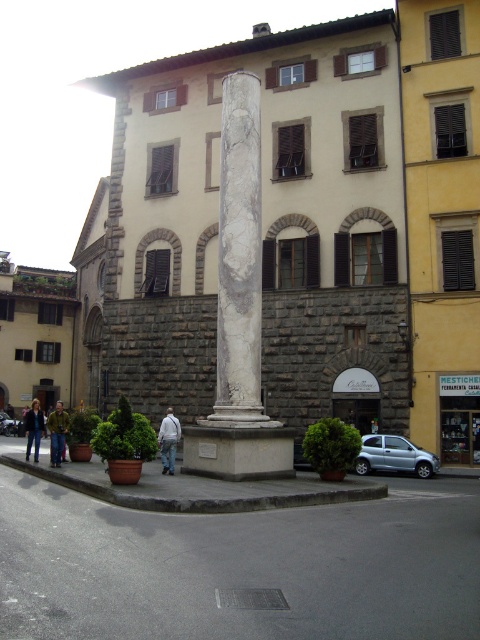
Question: Which point is farther to the camera?

Choices:
 (A) green textured jacket at lower left
 (B) white cotton jacket at center
 (C) dark blue jacket at lower left

Answer: (C)

Question: Can you confirm if green textured jacket at lower left is positioned above dark blue jacket at lower left?

Choices:
 (A) no
 (B) yes

Answer: (B)

Question: Which object appears closest to the camera in this image?

Choices:
 (A) white cotton jacket at center
 (B) green textured jacket at lower left

Answer: (A)

Question: Is white marble column at center positioned at the back of green textured jacket at lower left?

Choices:
 (A) yes
 (B) no

Answer: (B)

Question: Which of the following is the closest to the observer?

Choices:
 (A) (26, 433)
 (B) (249, 476)
 (C) (49, 413)

Answer: (B)

Question: In this image, where is white cotton jacket at center located relative to green textured jacket at lower left?

Choices:
 (A) above
 (B) below

Answer: (A)